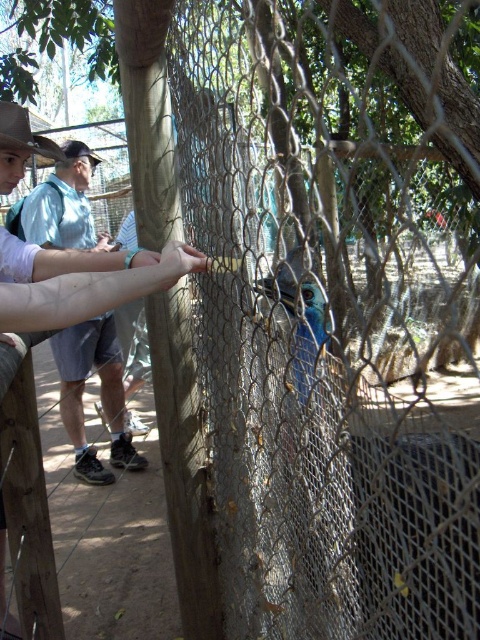
Question: Can you confirm if light blue shirt at center is positioned to the right of brown leather cowboy hat at upper left?

Choices:
 (A) yes
 (B) no

Answer: (A)

Question: Among these points, which one is farthest from the camera?

Choices:
 (A) (166, 285)
 (B) (27, 164)
 (C) (78, 196)

Answer: (B)

Question: Which of the following is the closest to the observer?

Choices:
 (A) (10, 134)
 (B) (73, 173)

Answer: (A)

Question: Which object appears closest to the camera in this image?

Choices:
 (A) light blue shirt at center
 (B) smooth skin hand at center

Answer: (B)

Question: Can you confirm if smooth skin hand at center is thinner than brown leather cowboy hat at upper left?

Choices:
 (A) no
 (B) yes

Answer: (A)

Question: Can you confirm if smooth skin hand at center is smaller than brown leather cowboy hat at upper left?

Choices:
 (A) no
 (B) yes

Answer: (A)